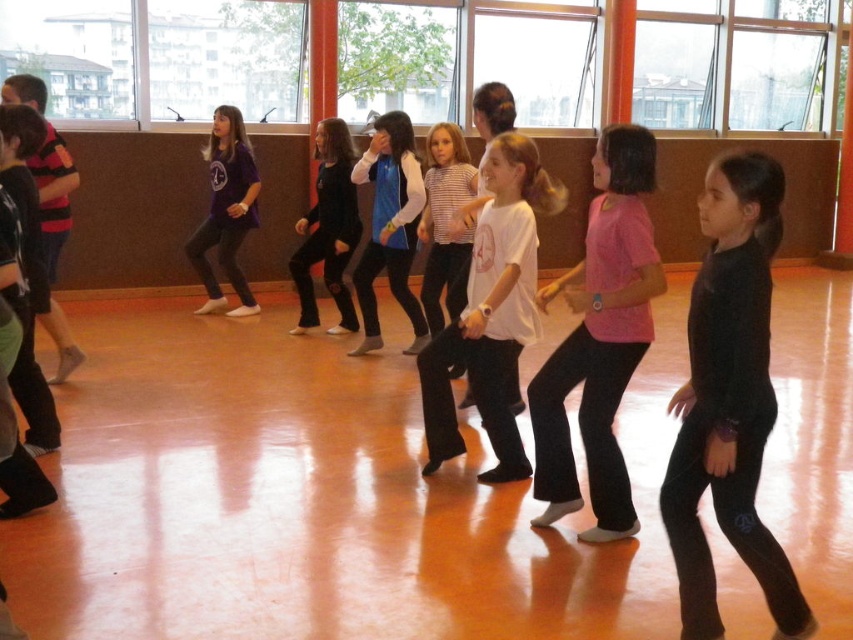
Find the location of a particular element. black matte leggings at right is located at coordinates (728, 403).

Is point (746, 401) in front of point (308, 259)?

Yes, point (746, 401) is in front of point (308, 259).

Does black matte leggings at right have a lesser height compared to black matte pants at center?

Indeed, black matte leggings at right has a lesser height compared to black matte pants at center.

Does point (680, 472) come closer to viewer compared to point (340, 147)?

Yes, point (680, 472) is closer to viewer.

The image size is (853, 640). Identify the location of black matte leggings at right. (728, 403).

The image size is (853, 640). Describe the element at coordinates (599, 339) in the screenshot. I see `pink matte shirt at center` at that location.

Is pink matte shirt at center to the left of matte purple shirt at center from the viewer's perspective?

No, pink matte shirt at center is not to the left of matte purple shirt at center.

Does point (633, 131) come farther from viewer compared to point (212, 282)?

No.

Where is `pink matte shirt at center`? pink matte shirt at center is located at coordinates (599, 339).